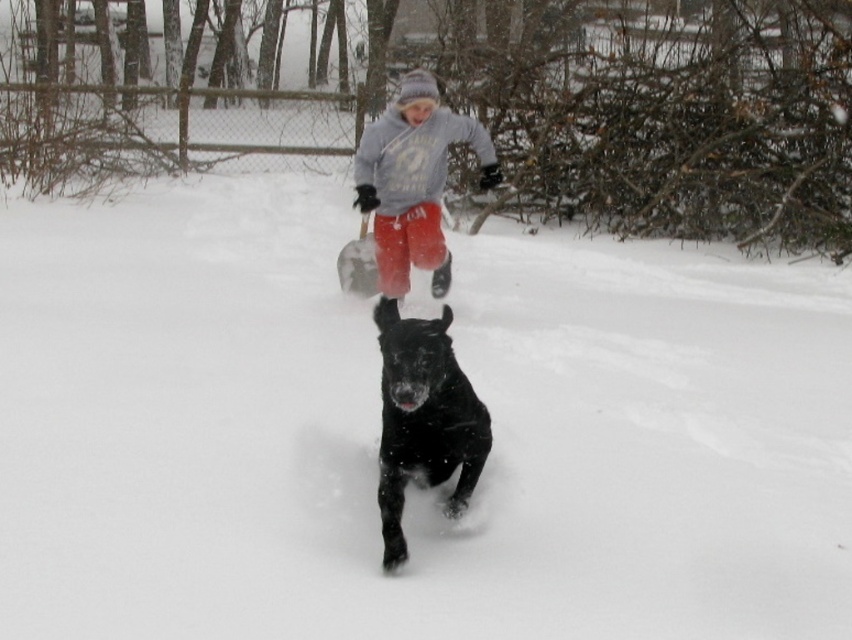
You are a photographer trying to capture the black glossy dog at center and the gray fleece sweatshirt at center in a single frame. Given their sizes in the image, which one will appear smaller in the photo?

The black glossy dog at center occupies less space than the gray fleece sweatshirt at center, so it will appear smaller in the photo.

You are a photographer trying to capture the scene. You want to ensure that both the black glossy dog at center and the gray fleece sweatshirt at center are in focus. Which object should you adjust your camera focus on first to ensure both are sharp?

The black glossy dog at center is below the gray fleece sweatshirt at center. To ensure both are in focus, focus on the gray fleece sweatshirt at center first since it is closer to the camera, and the depth of field will likely include the dog below it.